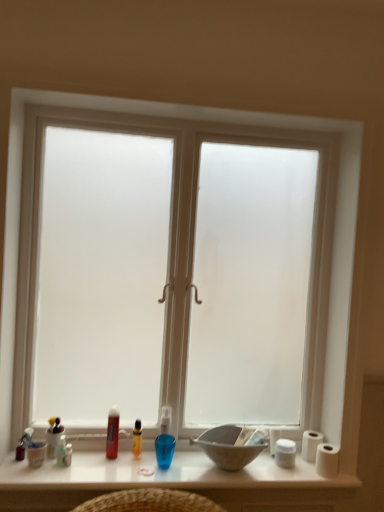
The height and width of the screenshot is (512, 384). What are the coordinates of `vacant region to the left of translucent plastic tube at lower center, the fourth toiletry viewed from the left` in the screenshot? It's located at (77, 457).